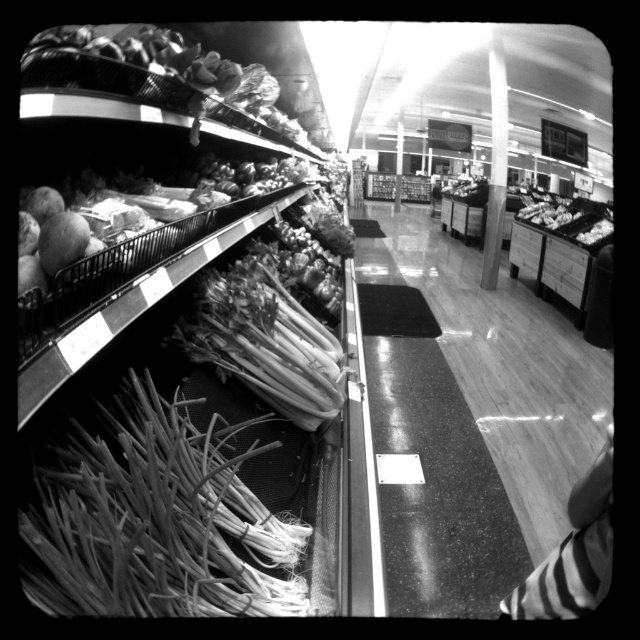
Question: Which point is farther to the camera?

Choices:
 (A) smooth green onions at center
 (B) smooth glossy floor at center
 (C) smooth green onions at lower left

Answer: (B)

Question: Does smooth glossy floor at center appear over smooth green onions at center?

Choices:
 (A) no
 (B) yes

Answer: (A)

Question: In this image, where is smooth green onions at lower left located relative to smooth green onions at center?

Choices:
 (A) above
 (B) below

Answer: (B)

Question: Which point is farther to the camera?

Choices:
 (A) (493, 522)
 (B) (145, 596)

Answer: (A)

Question: Observing the image, what is the correct spatial positioning of smooth glossy floor at center in reference to smooth green onions at lower left?

Choices:
 (A) left
 (B) right

Answer: (B)

Question: Estimate the real-world distances between objects in this image. Which object is closer to the smooth glossy floor at center?

Choices:
 (A) smooth green onions at center
 (B) smooth green onions at lower left

Answer: (A)